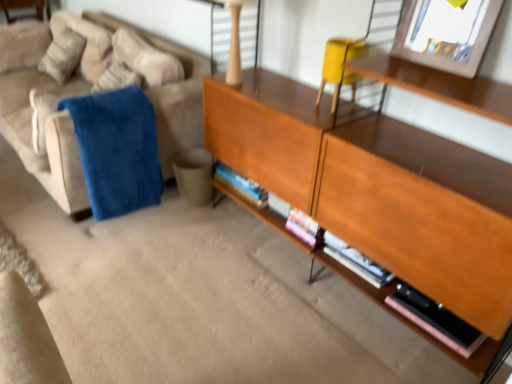
Question: Considering the relative sizes of blue plush blanket at left and matte yellow swivel chair at upper right in the image provided, is blue plush blanket at left smaller than matte yellow swivel chair at upper right?

Choices:
 (A) no
 (B) yes

Answer: (A)

Question: From the image's perspective, is blue plush blanket at left located beneath matte yellow swivel chair at upper right?

Choices:
 (A) yes
 (B) no

Answer: (A)

Question: From a real-world perspective, is blue plush blanket at left positioned over matte yellow swivel chair at upper right based on gravity?

Choices:
 (A) yes
 (B) no

Answer: (B)

Question: Considering the relative sizes of blue plush blanket at left and matte yellow swivel chair at upper right in the image provided, is blue plush blanket at left taller than matte yellow swivel chair at upper right?

Choices:
 (A) yes
 (B) no

Answer: (A)

Question: Does blue plush blanket at left turn towards matte yellow swivel chair at upper right?

Choices:
 (A) no
 (B) yes

Answer: (A)

Question: Is blue plush blanket at left thinner than matte yellow swivel chair at upper right?

Choices:
 (A) no
 (B) yes

Answer: (A)

Question: Considering the relative sizes of blue plush blanket at left and wooden picture frame at upper right in the image provided, is blue plush blanket at left wider than wooden picture frame at upper right?

Choices:
 (A) yes
 (B) no

Answer: (A)

Question: Is blue plush blanket at left far from wooden picture frame at upper right?

Choices:
 (A) no
 (B) yes

Answer: (B)

Question: Is blue plush blanket at left positioned with its back to wooden picture frame at upper right?

Choices:
 (A) yes
 (B) no

Answer: (B)

Question: Is blue plush blanket at left aimed at wooden picture frame at upper right?

Choices:
 (A) no
 (B) yes

Answer: (A)

Question: From a real-world perspective, is blue plush blanket at left beneath wooden picture frame at upper right?

Choices:
 (A) no
 (B) yes

Answer: (B)

Question: Does blue plush blanket at left lie in front of wooden picture frame at upper right?

Choices:
 (A) no
 (B) yes

Answer: (A)

Question: From a real-world perspective, is wooden picture frame at upper right positioned over wooden cabinet at center based on gravity?

Choices:
 (A) no
 (B) yes

Answer: (B)